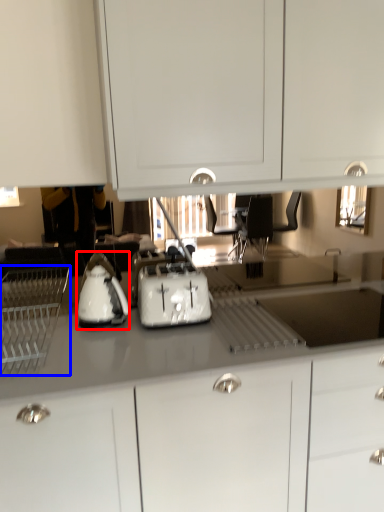
Question: Which point is closer to the camera, kitchen appliance (highlighted by a red box) or home appliance (highlighted by a blue box)?

Choices:
 (A) kitchen appliance
 (B) home appliance

Answer: (B)